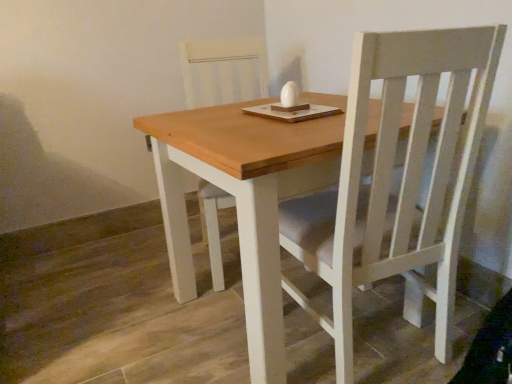
Question: Does point (185, 94) appear closer or farther from the camera than point (276, 162)?

Choices:
 (A) closer
 (B) farther

Answer: (B)

Question: Is white wood chair at center to the left or to the right of wooden table at center in the image?

Choices:
 (A) left
 (B) right

Answer: (A)

Question: From a real-world perspective, is white wood chair at center positioned above or below wooden table at center?

Choices:
 (A) below
 (B) above

Answer: (B)

Question: Looking at their shapes, would you say wooden table at center is wider or thinner than white wood chair at center?

Choices:
 (A) thin
 (B) wide

Answer: (B)

Question: Considering their positions, is wooden table at center located in front of or behind white wood chair at center?

Choices:
 (A) front
 (B) behind

Answer: (A)

Question: Is wooden table at center taller or shorter than white wood chair at center?

Choices:
 (A) tall
 (B) short

Answer: (B)

Question: Does point (239, 215) appear closer or farther from the camera than point (228, 77)?

Choices:
 (A) closer
 (B) farther

Answer: (A)